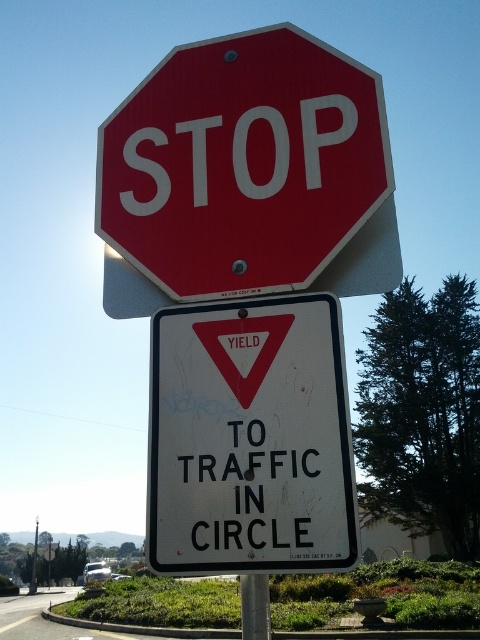
Question: Based on their relative distances, which object is farther from the smooth red stop sign at center?

Choices:
 (A) metallic pole at center
 (B) white matte yield sign at center

Answer: (A)

Question: Estimate the real-world distances between objects in this image. Which object is farther from the smooth red stop sign at center?

Choices:
 (A) white matte yield sign at center
 (B) metallic pole at center

Answer: (B)

Question: Is white matte yield sign at center thinner than metallic pole at center?

Choices:
 (A) yes
 (B) no

Answer: (A)

Question: Is smooth red stop sign at center further to camera compared to white matte yield sign at center?

Choices:
 (A) yes
 (B) no

Answer: (A)

Question: Where is smooth red stop sign at center located in relation to metallic pole at center in the image?

Choices:
 (A) left
 (B) right

Answer: (B)

Question: Which point appears closest to the camera in this image?

Choices:
 (A) (324, 157)
 (B) (326, 458)
 (C) (29, 580)

Answer: (B)